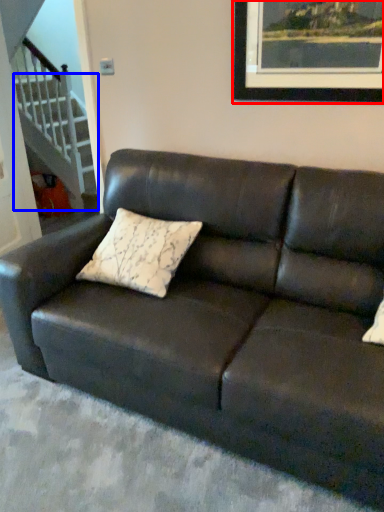
Question: Which point is further to the camera, picture frame (highlighted by a red box) or stairwell (highlighted by a blue box)?

Choices:
 (A) picture frame
 (B) stairwell

Answer: (B)